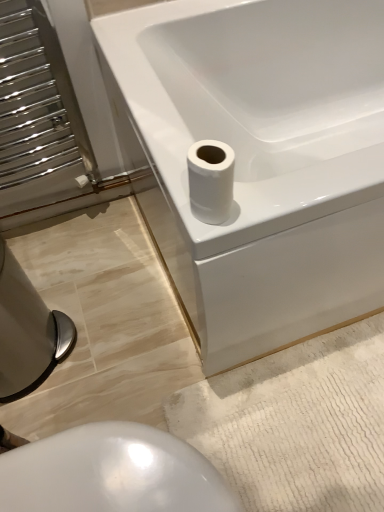
Locate an element on the screen. The width and height of the screenshot is (384, 512). vacant area that lies to the right of white glossy toilet paper at upper right is located at coordinates (293, 192).